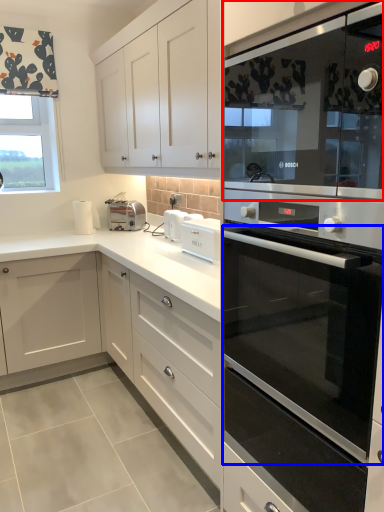
Question: Which of the following is the closest to the observer, microwave oven (highlighted by a red box) or oven (highlighted by a blue box)?

Choices:
 (A) microwave oven
 (B) oven

Answer: (A)